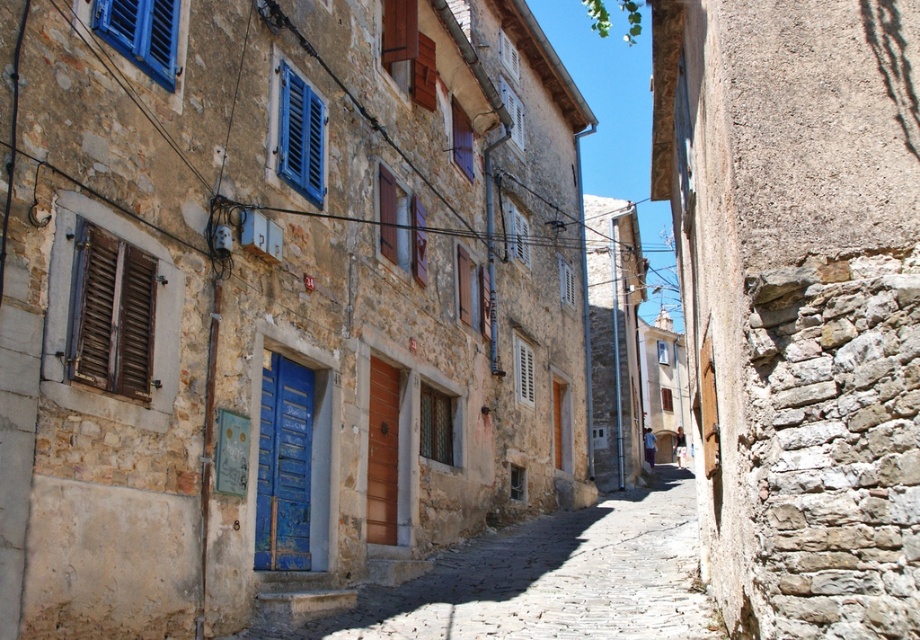
Which is more to the right, blue wooden shutters at center or white wooden shutter at center?

Positioned to the right is white wooden shutter at center.

Measure the distance between blue wooden shutters at center and camera.

blue wooden shutters at center is 44.45 feet from camera.

Locate an element on the screen. The image size is (920, 640). blue wooden shutters at center is located at coordinates (300, 136).

You are a GUI agent. You are given a task and a screenshot of the screen. Output one action in this format:
    pyautogui.click(x=<x>, y=<y>)
    Task: Click on the blue wooden shutters at center
    This screenshot has width=920, height=640.
    Given the screenshot: What is the action you would take?
    pyautogui.click(x=300, y=136)

Does blue wooden door at center appear under blue wooden shutters at center?

Yes, blue wooden door at center is below blue wooden shutters at center.

Image resolution: width=920 pixels, height=640 pixels. What do you see at coordinates (283, 465) in the screenshot? I see `blue wooden door at center` at bounding box center [283, 465].

Where is `blue wooden door at center`? This screenshot has height=640, width=920. blue wooden door at center is located at coordinates (283, 465).

Can you confirm if blue painted wood at upper left is bigger than blue wooden shutters at center?

No, blue painted wood at upper left is not bigger than blue wooden shutters at center.

Is blue painted wood at upper left to the right of blue wooden shutters at center from the viewer's perspective?

No, blue painted wood at upper left is not to the right of blue wooden shutters at center.

Is point (144, 20) behind point (291, 156)?

No, it is in front of (291, 156).

Find the location of a particular element. The height and width of the screenshot is (640, 920). blue painted wood at upper left is located at coordinates (141, 33).